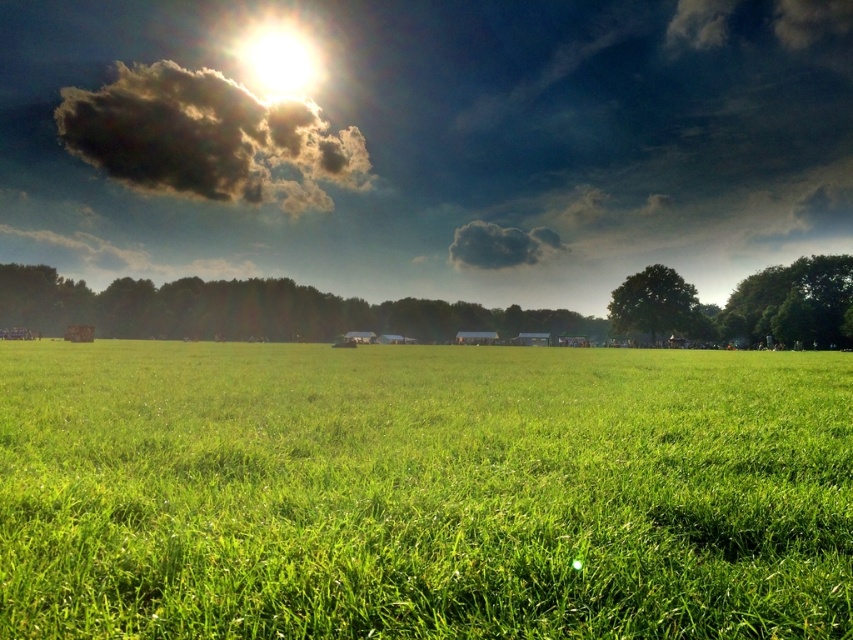
Question: In this image, where is dark fluffy cloud at upper center located relative to dark gray fluffy cloud at upper center?

Choices:
 (A) below
 (B) above

Answer: (B)

Question: Estimate the real-world distances between objects in this image. Which object is closer to the dark gray fluffy cloud at upper center?

Choices:
 (A) green grassy pasture at center
 (B) dark fluffy cloud at upper center

Answer: (B)

Question: Which point appears closest to the camera in this image?

Choices:
 (A) (668, 392)
 (B) (517, 234)
 (C) (352, 156)

Answer: (A)

Question: Is bright sun at upper center behind dark gray fluffy cloud at upper center?

Choices:
 (A) yes
 (B) no

Answer: (A)

Question: Considering the real-world distances, which object is farthest from the bright sun at upper center?

Choices:
 (A) green grassy pasture at center
 (B) dark fluffy cloud at upper center

Answer: (A)

Question: Does bright sun at upper center appear over dark gray fluffy cloud at upper center?

Choices:
 (A) no
 (B) yes

Answer: (B)